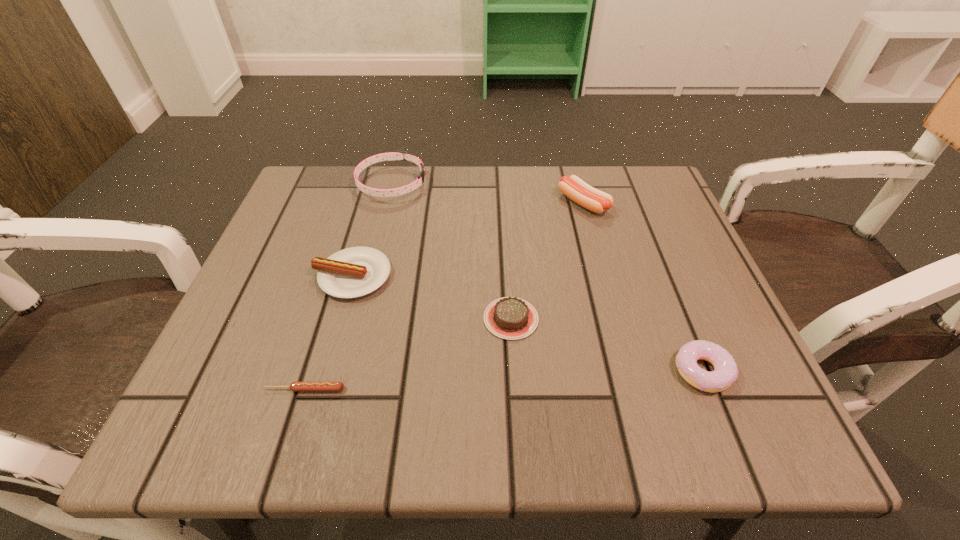
Find the location of a particular element. The width and height of the screenshot is (960, 540). free region located on the left of the tallest sausage is located at coordinates (488, 203).

At what (x,y) coordinates should I click in order to perform the action: click on blank space located on the back of the second shortest sausage. Please return your answer as a coordinate pair (x, y). This screenshot has height=540, width=960. Looking at the image, I should click on (378, 183).

Locate an element on the screen. The height and width of the screenshot is (540, 960). free space located on the front of the rightmost object is located at coordinates (731, 442).

Image resolution: width=960 pixels, height=540 pixels. Find the location of `vacant space located on the back of the chocolate cake`. vacant space located on the back of the chocolate cake is located at coordinates (506, 243).

What are the coordinates of `vacant region located on the right of the shortest sausage` in the screenshot? It's located at (437, 389).

Locate an element on the screen. The width and height of the screenshot is (960, 540). dog collar present at the far edge is located at coordinates (397, 154).

At what (x,y) coordinates should I click in order to perform the action: click on sausage that is at the far edge. Please return your answer as a coordinate pair (x, y). This screenshot has width=960, height=540. Looking at the image, I should click on pyautogui.click(x=573, y=187).

The width and height of the screenshot is (960, 540). Identify the location of doughnut situated at the near edge. (725, 372).

This screenshot has width=960, height=540. Identify the location of sausage that is at the near edge. (294, 386).

Where is `dog collar at the left edge`? This screenshot has width=960, height=540. dog collar at the left edge is located at coordinates (397, 154).